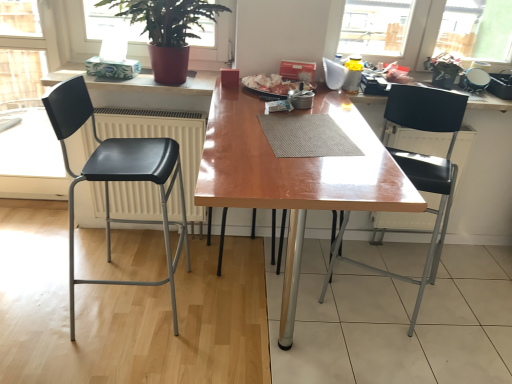
Find the location of `free point below wooden table at center (from a real-world perspective)`. free point below wooden table at center (from a real-world perspective) is located at coordinates (295, 321).